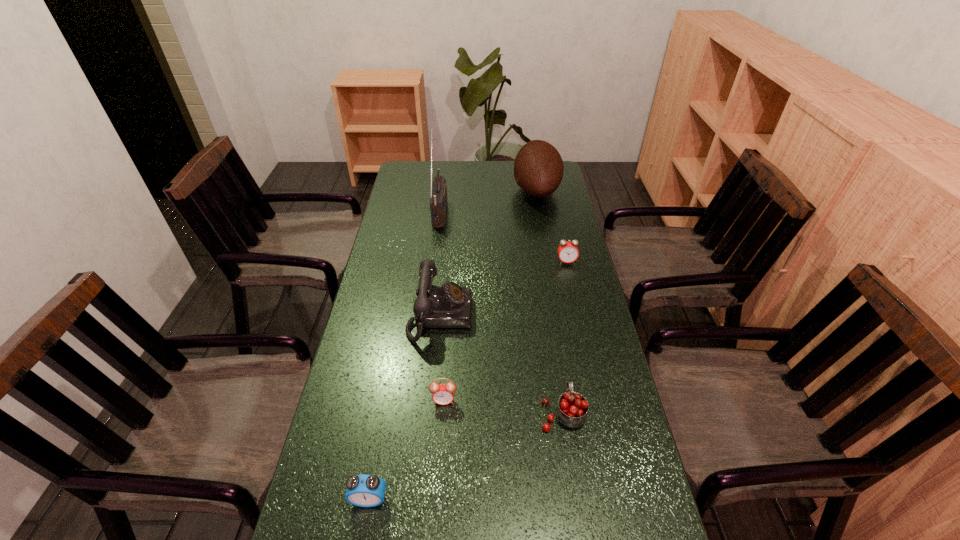
The height and width of the screenshot is (540, 960). In order to click on vacant position located on the front-facing side of the radio receiver in this screenshot , I will do `click(476, 211)`.

This screenshot has width=960, height=540. What are the coordinates of `blank area located 0.140m on the laces of the second tallest object` in the screenshot? It's located at (480, 190).

This screenshot has width=960, height=540. I want to click on vacant space located on the laces of the second tallest object, so (432, 190).

Where is `blank space located 0.350m on the laces of the second tallest object`? blank space located 0.350m on the laces of the second tallest object is located at coordinates (432, 190).

At what (x,y) coordinates should I click in order to perform the action: click on vacant space located 0.160m on the dial of the telephone. Please return your answer as a coordinate pair (x, y). Looking at the image, I should click on (524, 316).

Locate an element on the screen. This screenshot has width=960, height=540. free space located on the handle side of the cherry is located at coordinates point(557,375).

The height and width of the screenshot is (540, 960). What are the coordinates of `vacant space situated on the handle side of the cherry` in the screenshot? It's located at (556, 368).

Find the location of `vacant region located on the handle side of the cherry`. vacant region located on the handle side of the cherry is located at coordinates (557, 375).

Identify the location of free space located on the front-facing side of the fifth nearest object. The width and height of the screenshot is (960, 540). click(x=588, y=354).

In order to click on vacant space located 0.100m on the clock face of the second farthest alarm clock in this screenshot , I will do `click(441, 443)`.